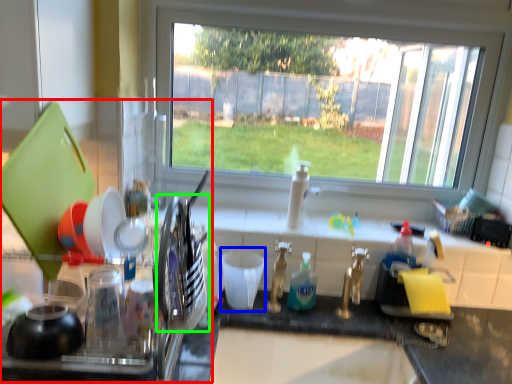
Question: Estimate the real-world distances between objects in this image. Which object is closer to appliance (highlighted by a red box), tableware (highlighted by a blue box) or tableware (highlighted by a green box)?

Choices:
 (A) tableware
 (B) tableware

Answer: (B)